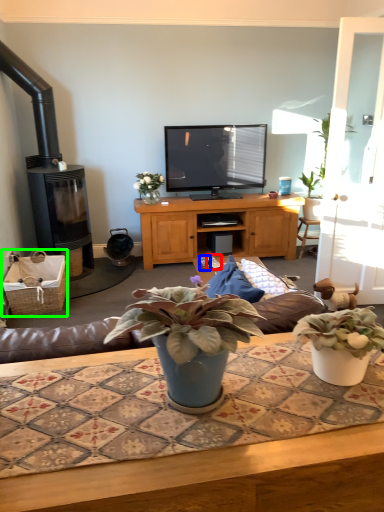
Question: Which object is the farthest from remote control (highlighted by a red box)? Choose among these: remote control (highlighted by a blue box) or picnic basket (highlighted by a green box).

Choices:
 (A) remote control
 (B) picnic basket

Answer: (B)